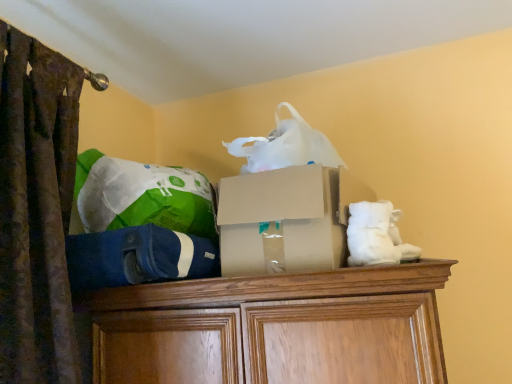
Question: Is blue fabric bean bag chair at center, acting as the second bean bag chair starting from the top, looking in the opposite direction of cardboard box at center?

Choices:
 (A) no
 (B) yes

Answer: (A)

Question: From the image's perspective, is blue fabric bean bag chair at center, acting as the second bean bag chair starting from the top, on top of cardboard box at center?

Choices:
 (A) no
 (B) yes

Answer: (A)

Question: Considering the relative positions of blue fabric bean bag chair at center, which is the first bean bag chair in bottom-to-top order, and cardboard box at center in the image provided, is blue fabric bean bag chair at center, which is the first bean bag chair in bottom-to-top order, to the right of cardboard box at center from the viewer's perspective?

Choices:
 (A) yes
 (B) no

Answer: (B)

Question: From a real-world perspective, does blue fabric bean bag chair at center, which is the first bean bag chair in bottom-to-top order, stand above cardboard box at center?

Choices:
 (A) yes
 (B) no

Answer: (B)

Question: From a real-world perspective, does blue fabric bean bag chair at center, which is the first bean bag chair in bottom-to-top order, sit lower than cardboard box at center?

Choices:
 (A) no
 (B) yes

Answer: (B)

Question: In the image, is blue fabric bean bag chair at center, which is the first bean bag chair in bottom-to-top order, positioned in front of or behind cardboard box at center?

Choices:
 (A) behind
 (B) front

Answer: (B)

Question: Considering the positions of point (130, 258) and point (223, 259), is point (130, 258) closer or farther from the camera than point (223, 259)?

Choices:
 (A) farther
 (B) closer

Answer: (B)

Question: Considering the positions of blue fabric bean bag chair at center, which is the first bean bag chair in bottom-to-top order, and cardboard box at center in the image, is blue fabric bean bag chair at center, which is the first bean bag chair in bottom-to-top order, taller or shorter than cardboard box at center?

Choices:
 (A) tall
 (B) short

Answer: (B)

Question: Is blue fabric bean bag chair at center, acting as the second bean bag chair starting from the top, bigger or smaller than cardboard box at center?

Choices:
 (A) small
 (B) big

Answer: (A)

Question: Based on their sizes in the image, would you say cardboard box at center is bigger or smaller than green fabric bean bag chair at upper left, positioned as the second bean bag chair in bottom-to-top order?

Choices:
 (A) big
 (B) small

Answer: (A)

Question: In terms of width, does cardboard box at center look wider or thinner when compared to green fabric bean bag chair at upper left, positioned as the second bean bag chair in bottom-to-top order?

Choices:
 (A) wide
 (B) thin

Answer: (A)

Question: Based on their positions, is cardboard box at center located to the left or right of green fabric bean bag chair at upper left, positioned as the second bean bag chair in bottom-to-top order?

Choices:
 (A) right
 (B) left

Answer: (A)

Question: Considering the positions of cardboard box at center and green fabric bean bag chair at upper left, positioned as the second bean bag chair in bottom-to-top order, in the image, is cardboard box at center taller or shorter than green fabric bean bag chair at upper left, positioned as the second bean bag chair in bottom-to-top order,?

Choices:
 (A) short
 (B) tall

Answer: (A)

Question: Considering their positions, is green fabric bean bag chair at upper left, which is the first bean bag chair in top-to-bottom order, located in front of or behind blue fabric bean bag chair at center, acting as the second bean bag chair starting from the top?

Choices:
 (A) front
 (B) behind

Answer: (B)

Question: From a real-world perspective, is green fabric bean bag chair at upper left, positioned as the second bean bag chair in bottom-to-top order, above or below blue fabric bean bag chair at center, which is the first bean bag chair in bottom-to-top order?

Choices:
 (A) above
 (B) below

Answer: (A)